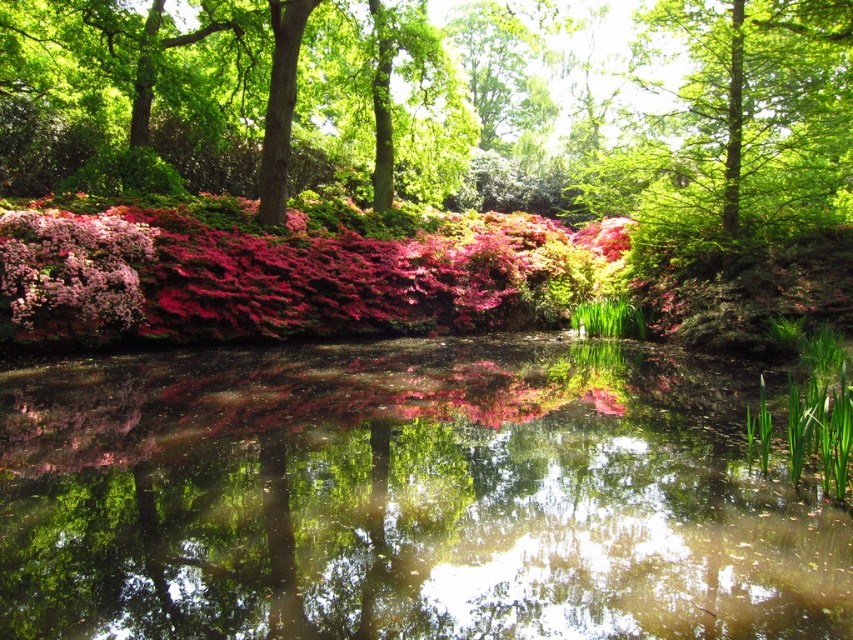
Question: Does transparent water at center appear on the left side of pink matte flowers at center?

Choices:
 (A) no
 (B) yes

Answer: (A)

Question: Can you confirm if transparent water at center is positioned to the right of pink matte flowers at center?

Choices:
 (A) yes
 (B) no

Answer: (A)

Question: Among these objects, which one is farthest from the camera?

Choices:
 (A) transparent water at center
 (B) pink matte flowers at center

Answer: (B)

Question: Considering the relative positions of transparent water at center and pink matte flowers at center in the image provided, where is transparent water at center located with respect to pink matte flowers at center?

Choices:
 (A) below
 (B) above

Answer: (A)

Question: Which point is closer to the camera?

Choices:
 (A) transparent water at center
 (B) pink matte flowers at center

Answer: (A)